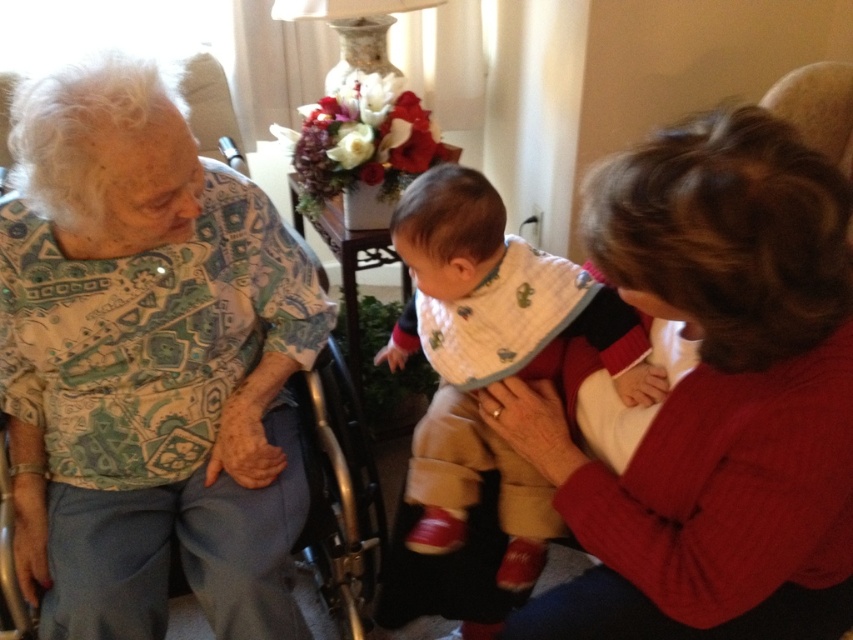
Describe the element at coordinates (148, 365) in the screenshot. I see `printed fabric shirt at left` at that location.

The width and height of the screenshot is (853, 640). What do you see at coordinates (148, 365) in the screenshot?
I see `printed fabric shirt at left` at bounding box center [148, 365].

Find the location of `printed fabric shirt at left`. printed fabric shirt at left is located at coordinates (148, 365).

Does matte red sweater at center have a lesser width compared to white cotton bib at center?

In fact, matte red sweater at center might be wider than white cotton bib at center.

Who is positioned more to the left, matte red sweater at center or white cotton bib at center?

Positioned to the left is white cotton bib at center.

Is point (712, 145) behind point (434, 195)?

That is False.

Identify the location of matte red sweater at center. (711, 397).

Is printed fabric shirt at left bigger than matte red sweater at center?

Yes, printed fabric shirt at left is bigger than matte red sweater at center.

What do you see at coordinates (148, 365) in the screenshot?
I see `printed fabric shirt at left` at bounding box center [148, 365].

The width and height of the screenshot is (853, 640). In order to click on printed fabric shirt at left in this screenshot , I will do `click(148, 365)`.